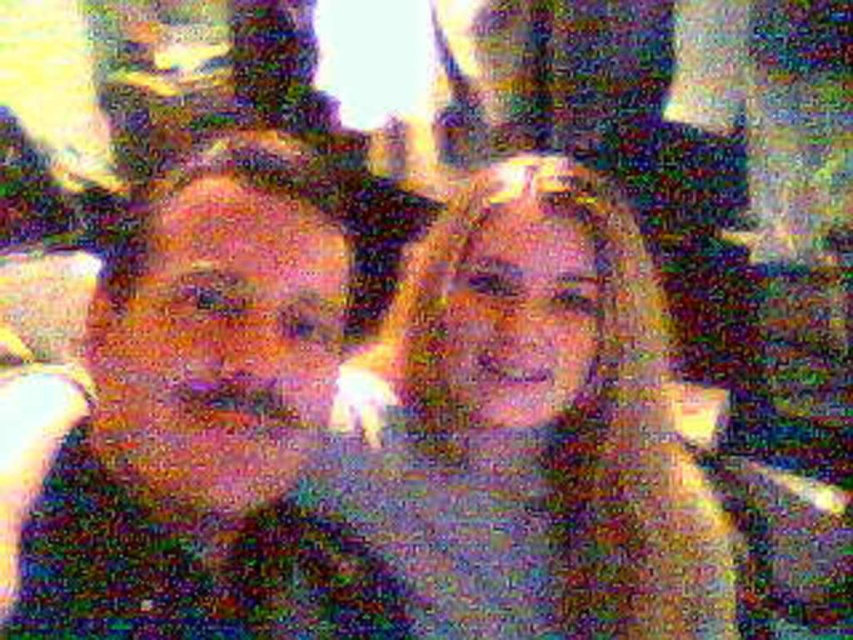
Between point (102, 508) and point (653, 608), which one is positioned in front?

Point (102, 508) is in front.

You are a GUI agent. You are given a task and a screenshot of the screen. Output one action in this format:
    pyautogui.click(x=<x>, y=<y>)
    Task: Click on the matte black face at center
    
    Given the screenshot: What is the action you would take?
    pyautogui.click(x=196, y=410)